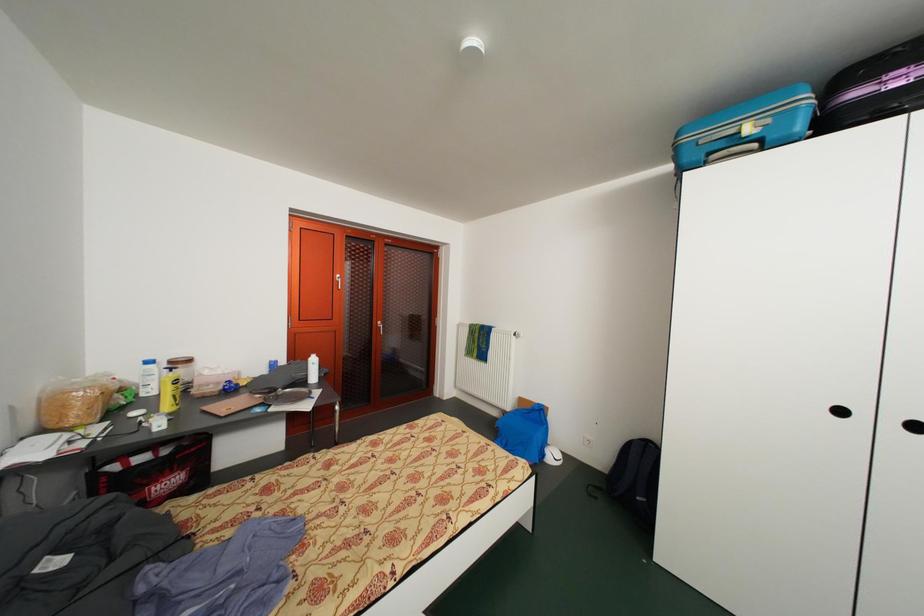
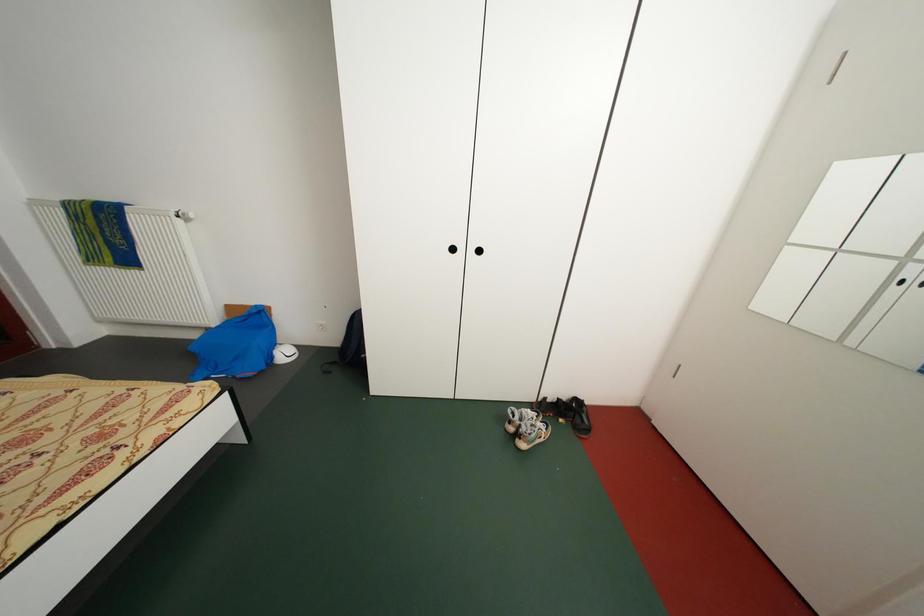
Consider the image. The images are taken continuously from a first-person perspective. In which direction is your viewpoint rotating?

The camera's rotation is toward right-down.